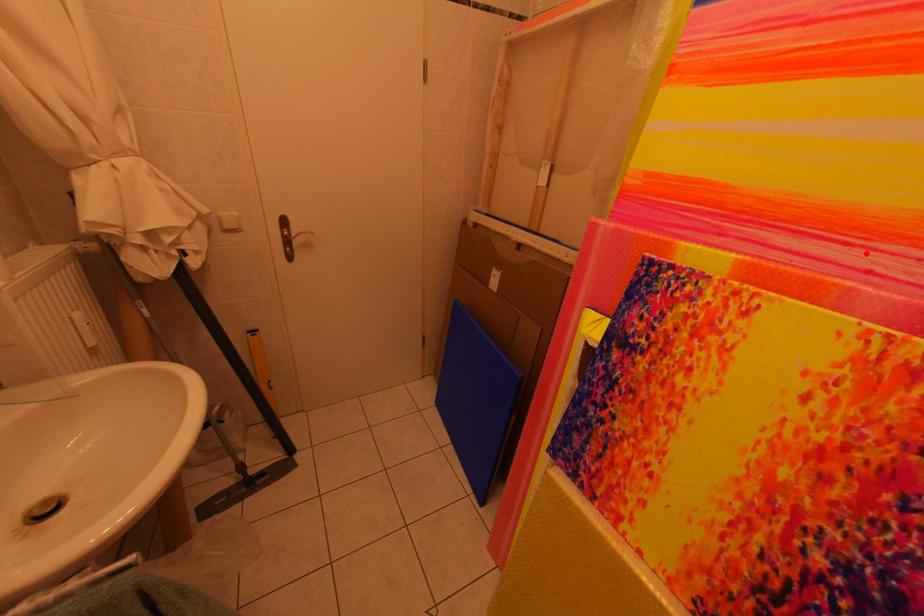
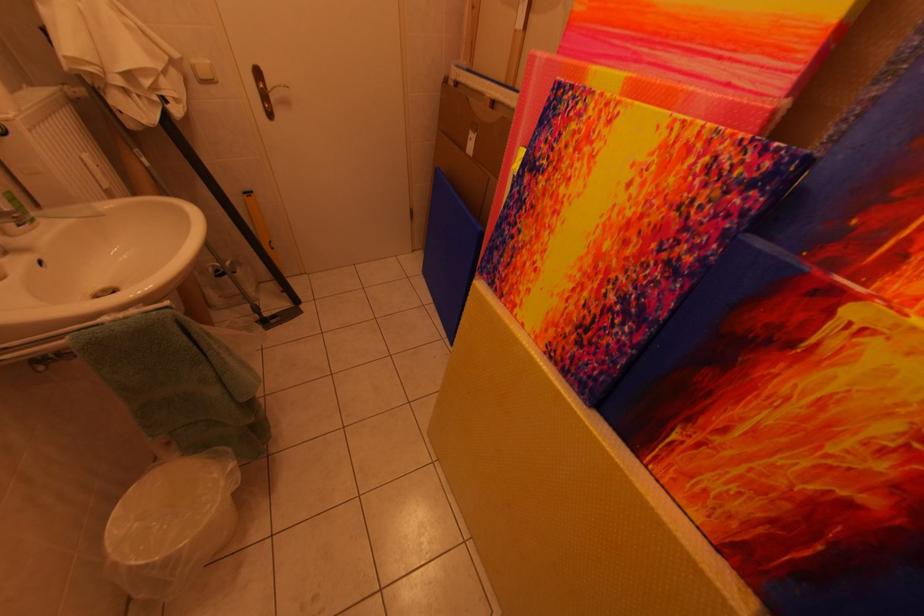
Find the pixel in the second image that matches the highlighted location in the first image.

(734, 68)